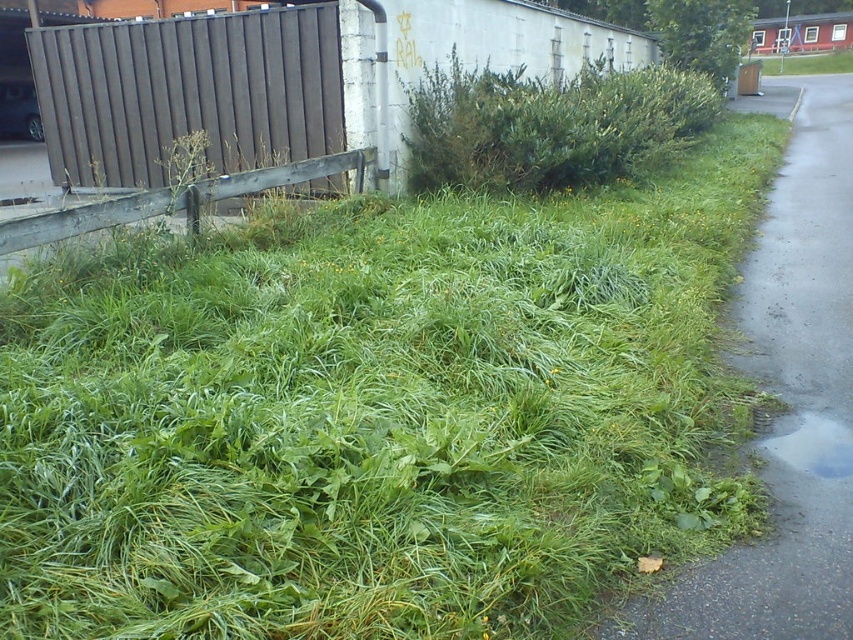
You are a hiker who wants to cross the transparent water at lower right. There is a brown corrugated metal fence at upper left in your way. Can you go around the fence to reach the water?

The brown corrugated metal fence at upper left is located above the transparent water at lower right, so the fence is not blocking your path to the water. You can go around the fence and reach the transparent water at lower right.

You are a gardener who needs to trim the green leafy bush at upper center and the brown corrugated metal fence at upper left. Your gardening tools are 3 feet wide. Can you move your tools between the two objects without hitting them?

The distance between the brown corrugated metal fence at upper left and the green leafy bush at upper center is 5.36 feet. Since your tools are 3 feet wide, there is enough space to move them between the two objects without hitting either one.